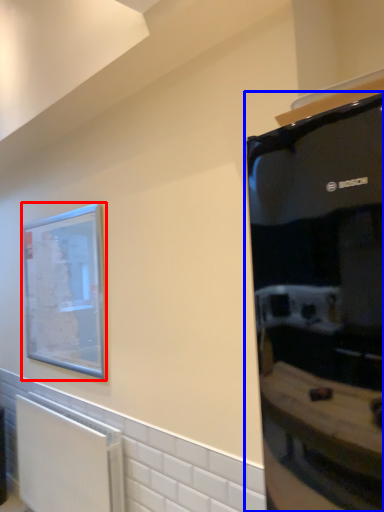
Question: Which point is closer to the camera, picture frame (highlighted by a red box) or appliance (highlighted by a blue box)?

Choices:
 (A) picture frame
 (B) appliance

Answer: (B)